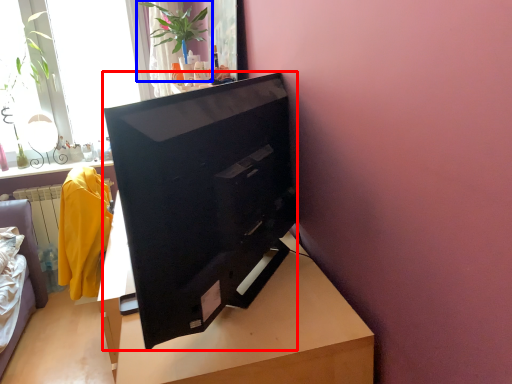
Question: Which object appears closest to the camera in this image, television (highlighted by a red box) or houseplant (highlighted by a blue box)?

Choices:
 (A) television
 (B) houseplant

Answer: (A)